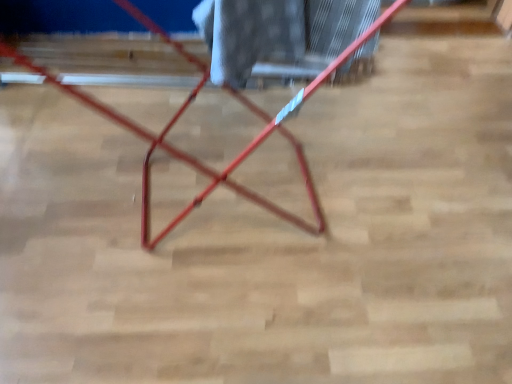
Question: From the image's perspective, is white textured fabric at center under metallic red ladder at center?

Choices:
 (A) yes
 (B) no

Answer: (B)

Question: Is white textured fabric at center shorter than metallic red ladder at center?

Choices:
 (A) yes
 (B) no

Answer: (A)

Question: Is white textured fabric at center located outside metallic red ladder at center?

Choices:
 (A) yes
 (B) no

Answer: (B)

Question: Does white textured fabric at center have a larger size compared to metallic red ladder at center?

Choices:
 (A) yes
 (B) no

Answer: (B)

Question: Can you confirm if white textured fabric at center is taller than metallic red ladder at center?

Choices:
 (A) no
 (B) yes

Answer: (A)

Question: Can you confirm if white textured fabric at center is thinner than metallic red ladder at center?

Choices:
 (A) no
 (B) yes

Answer: (B)

Question: From the image's perspective, is metallic red ladder at center below white textured fabric at center?

Choices:
 (A) no
 (B) yes

Answer: (B)

Question: From the image's perspective, is metallic red ladder at center on white textured fabric at center?

Choices:
 (A) yes
 (B) no

Answer: (B)

Question: Is metallic red ladder at center aimed at white textured fabric at center?

Choices:
 (A) no
 (B) yes

Answer: (B)

Question: From a real-world perspective, is metallic red ladder at center on white textured fabric at center?

Choices:
 (A) yes
 (B) no

Answer: (B)

Question: Is metallic red ladder at center at the right side of white textured fabric at center?

Choices:
 (A) no
 (B) yes

Answer: (A)

Question: Is metallic red ladder at center bigger than white textured fabric at center?

Choices:
 (A) no
 (B) yes

Answer: (B)

Question: Considering their positions, is white textured fabric at center located in front of or behind metallic red ladder at center?

Choices:
 (A) behind
 (B) front

Answer: (A)